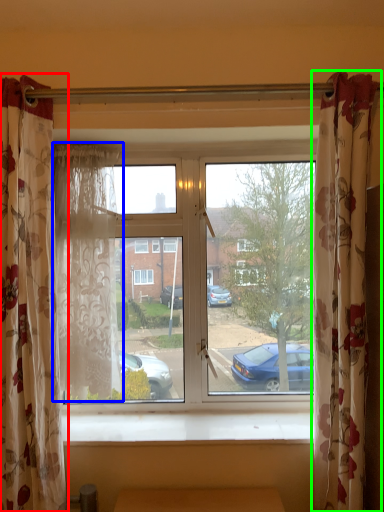
Question: Which object is the closest to the curtain (highlighted by a red box)? Choose among these: curtain (highlighted by a blue box) or curtain (highlighted by a green box).

Choices:
 (A) curtain
 (B) curtain

Answer: (A)